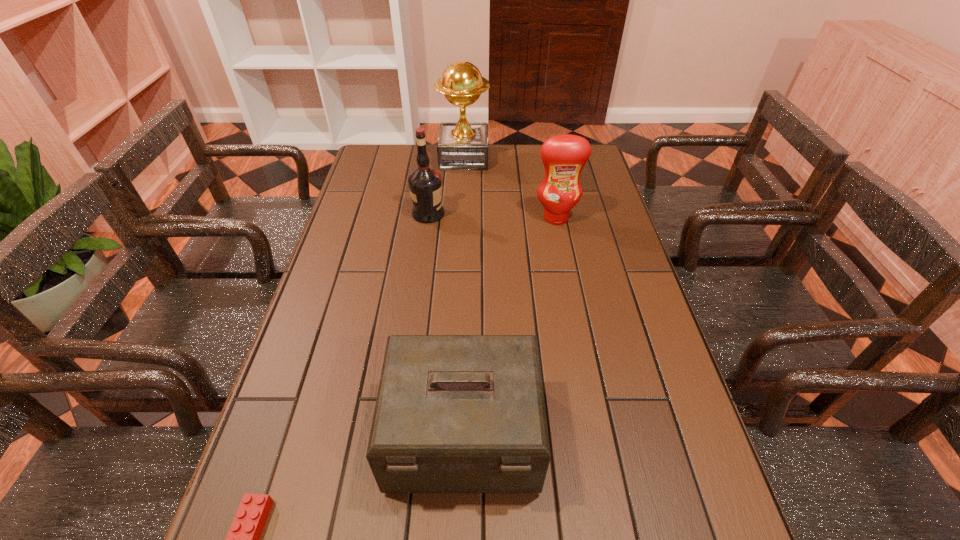
At what (x,y) coordinates should I click in order to perform the action: click on free spot between the fourth tallest object and the farthest object. Please return your answer as a coordinate pair (x, y). Looking at the image, I should click on coord(464,296).

Locate which object is the fourth closest to the shortest object. Please provide its 2D coordinates. Your answer should be formatted as a tuple, i.e. [(x, y)], where the tuple contains the x and y coordinates of a point satisfying the conditions above.

[(461, 146)]

Choose which object is the fourth nearest neighbor to the second shortest object. Please provide its 2D coordinates. Your answer should be formatted as a tuple, i.e. [(x, y)], where the tuple contains the x and y coordinates of a point satisfying the conditions above.

[(461, 146)]

Locate an element on the screen. This screenshot has height=540, width=960. free spot that satisfies the following two spatial constraints: 1. on the back side of the fourth tallest object; 2. on the front-facing side of the award is located at coordinates (x=471, y=158).

Where is `vacant space that satisfies the following two spatial constraints: 1. on the back side of the fourth tallest object; 2. on the front-facing side of the farthest object`? The image size is (960, 540). vacant space that satisfies the following two spatial constraints: 1. on the back side of the fourth tallest object; 2. on the front-facing side of the farthest object is located at coordinates (471, 158).